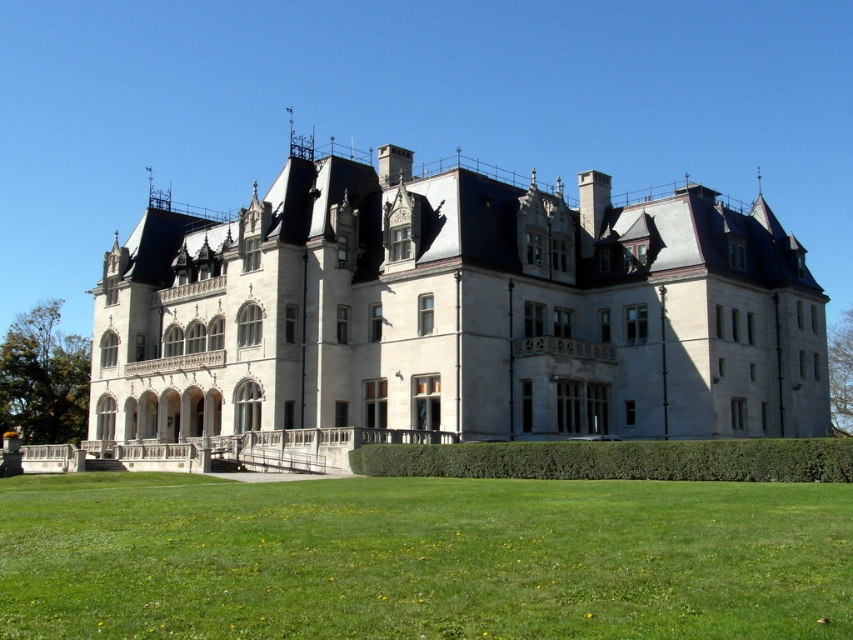
You are standing at the point marked by the coordinates point (x=421, y=557) in the mansion image. What type of terrain are you currently standing on?

The point (x=421, y=557) marks green grass at lower center, so you are standing on green grass.

You are a landscape architect designing a garden for the property. Given the stone mansion at center and the green grass at lower center, which object should you prioritize in terms of scale when planning the layout to maintain visual harmony?

The stone mansion at center is larger in size than green grass at lower center, so you should prioritize the stone mansion at center in terms of scale to maintain visual harmony with the existing structure.

You are standing at the point marked by coordinates (453,314) in the image of the mansion. What object are you directly at?

You are directly at the stone mansion at center, as the point (453,314) represents its location.